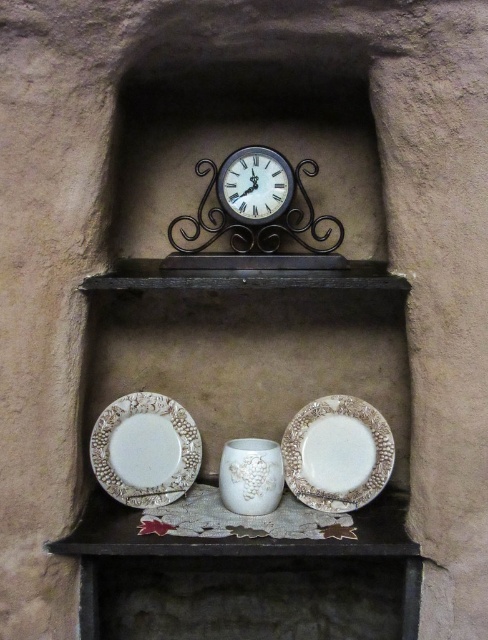
Which is more to the right, white ceramic platter at lower left or white textured platter at lower center?

From the viewer's perspective, white textured platter at lower center appears more on the right side.

Is white ceramic platter at lower left thinner than white textured platter at lower center?

No.

Which is behind, point (174, 465) or point (343, 472)?

Positioned behind is point (174, 465).

Where is `white ceramic platter at lower left`? white ceramic platter at lower left is located at coordinates (144, 449).

Measure the distance between point [150,468] and camera.

They are 1.27 meters apart.

Between white ceramic platter at lower left and metallic clock at center, which one has more height?

With more height is white ceramic platter at lower left.

Between point (116, 426) and point (280, 156), which one is positioned in front?

Point (280, 156) is in front.

The image size is (488, 640). In order to click on white ceramic platter at lower left in this screenshot , I will do `click(144, 449)`.

Which is above, white textured platter at lower center or metallic clock at center?

metallic clock at center is higher up.

Between point (302, 483) and point (262, 204), which one is positioned in front?

Point (262, 204)

At what (x,y) coordinates should I click in order to perform the action: click on white textured platter at lower center. Please return your answer as a coordinate pair (x, y). This screenshot has height=640, width=488. Looking at the image, I should click on (310, 445).